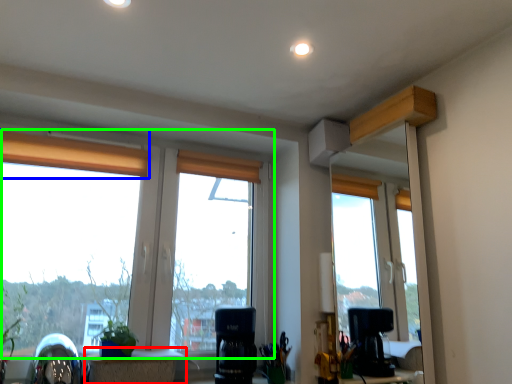
Question: Which object is positioned closest to table (highlighted by a red box)? Select from curtain (highlighted by a blue box) and window (highlighted by a green box).

Choices:
 (A) curtain
 (B) window

Answer: (B)